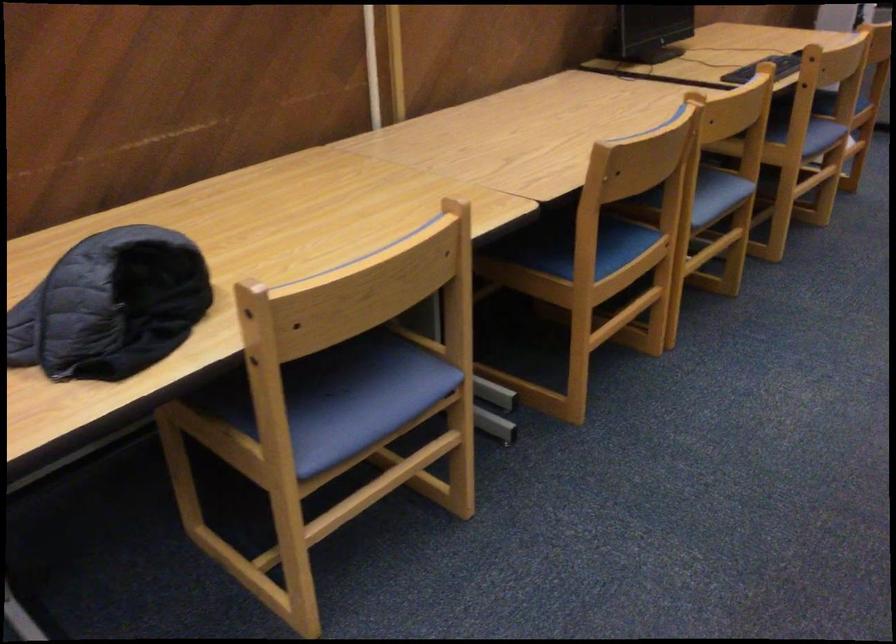
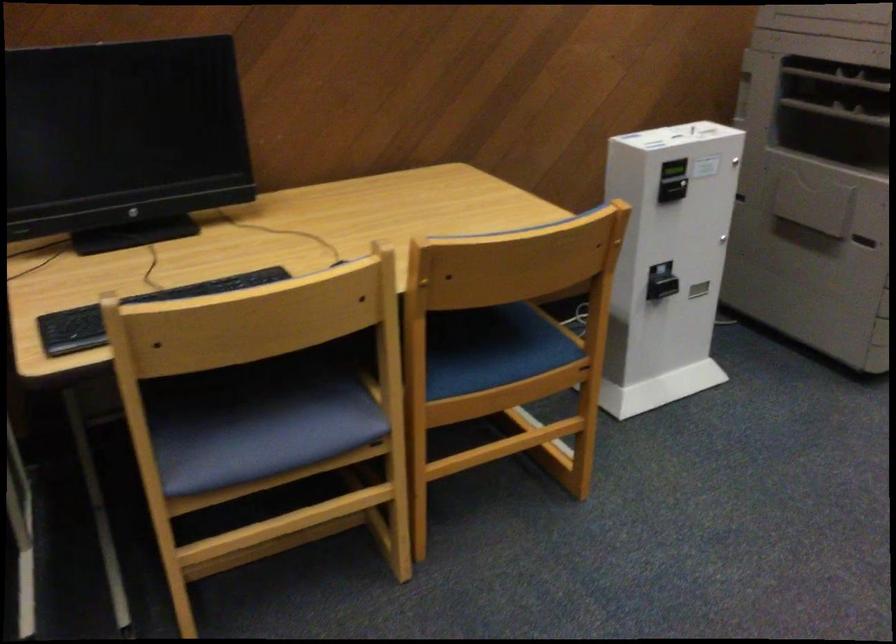
In the second image, find the point that corresponds to (x=791, y=126) in the first image.

(255, 422)